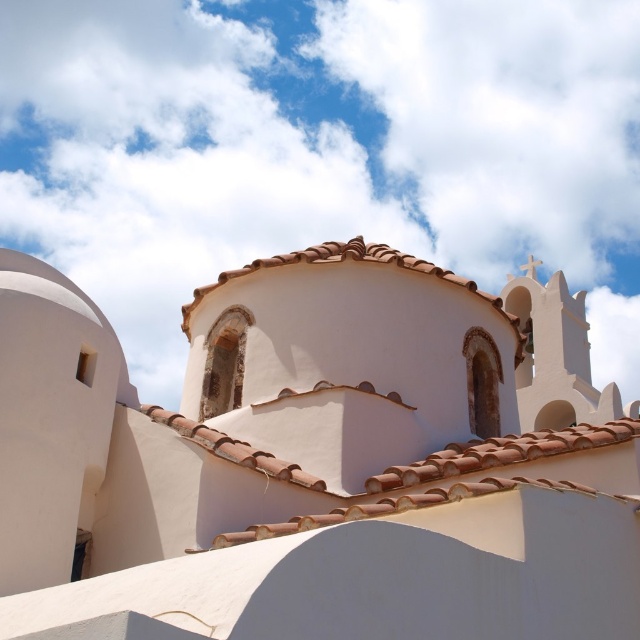
Question: Does white matte dome at center have a smaller size compared to brown clay tiles at upper center?

Choices:
 (A) yes
 (B) no

Answer: (B)

Question: Which object appears closest to the camera in this image?

Choices:
 (A) brown clay tiles at upper center
 (B) white fluffy cloud at upper center
 (C) white matte dome at center

Answer: (C)

Question: In this image, where is white matte dome at center located relative to brown clay tiles at upper center?

Choices:
 (A) left
 (B) right

Answer: (B)

Question: Does white matte dome at center appear over white fluffy cloud at upper center?

Choices:
 (A) no
 (B) yes

Answer: (A)

Question: Which point is closer to the camera?

Choices:
 (A) pyautogui.click(x=572, y=449)
 (B) pyautogui.click(x=296, y=138)

Answer: (A)

Question: Which object is positioned closest to the brown clay tiles at upper center?

Choices:
 (A) white fluffy cloud at upper center
 (B) white matte dome at center

Answer: (B)